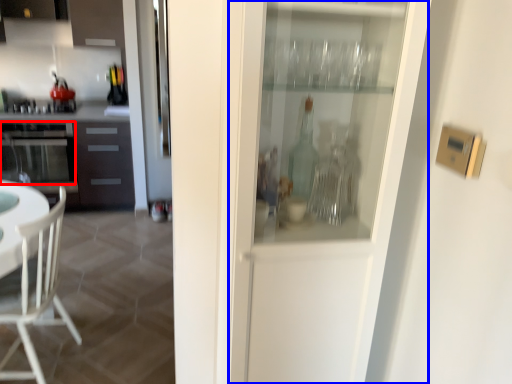
Question: Among these objects, which one is farthest to the camera, oven (highlighted by a red box) or screen door (highlighted by a blue box)?

Choices:
 (A) oven
 (B) screen door

Answer: (A)